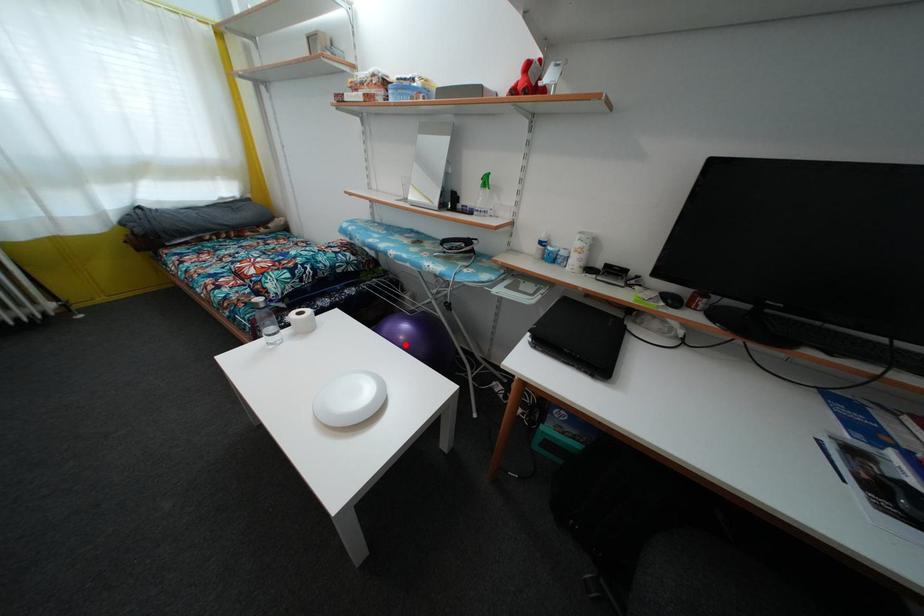
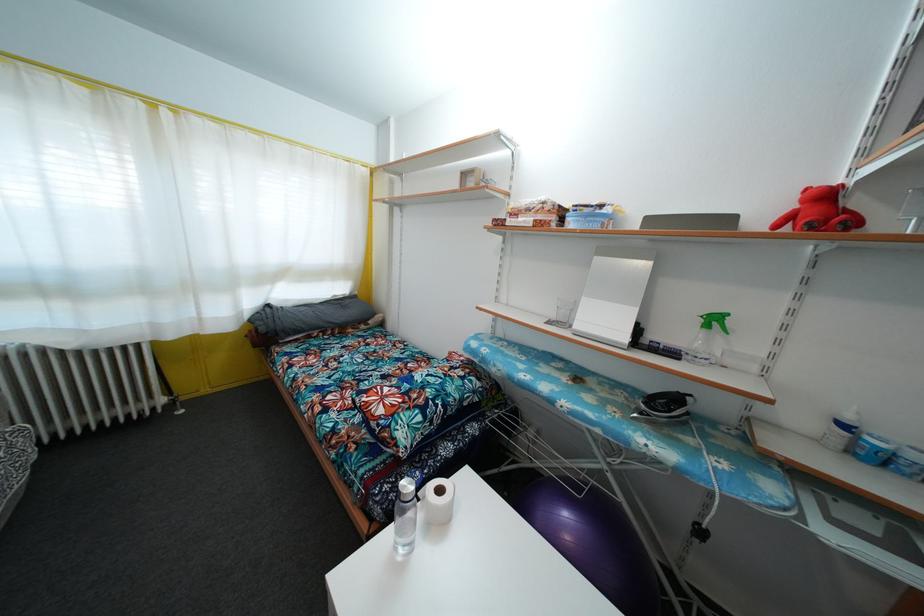
Locate, in the second image, the point that corresponds to the highlighted location in the first image.

(572, 545)